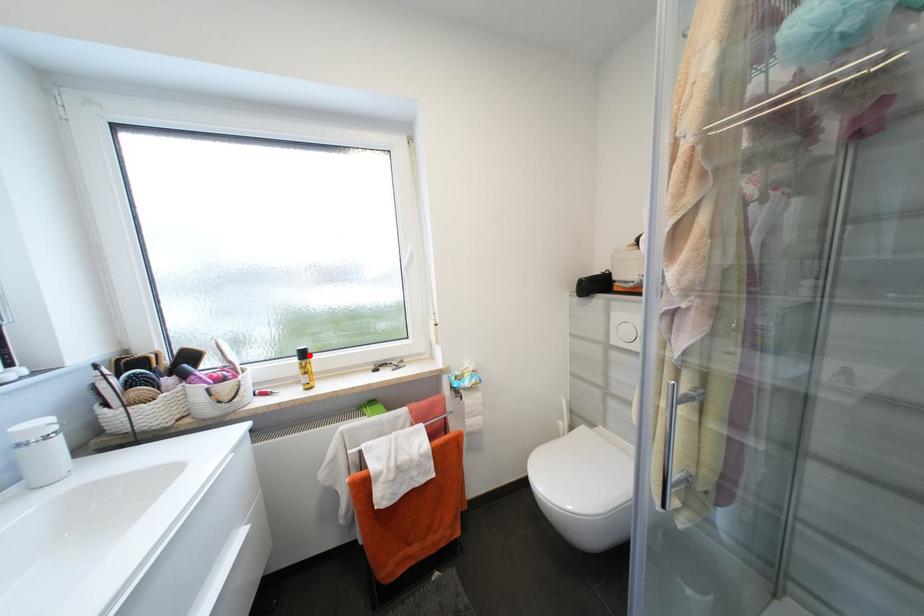
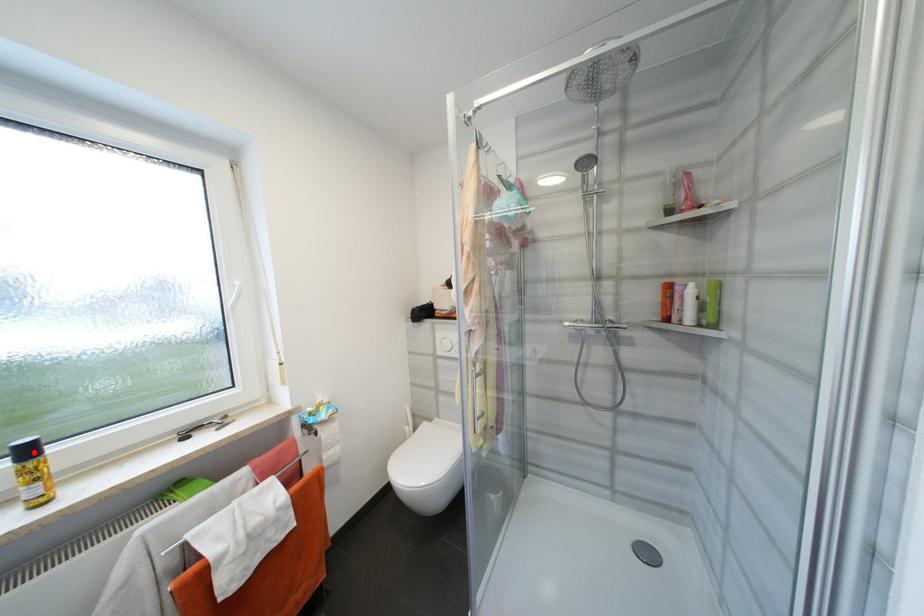
Consider the image. I am providing you with two images of the same scene from different viewpoints. A red point is marked on the first image and another point is marked on the second image. Is the red point in image1 aligned with the point shown in image2?

Yes